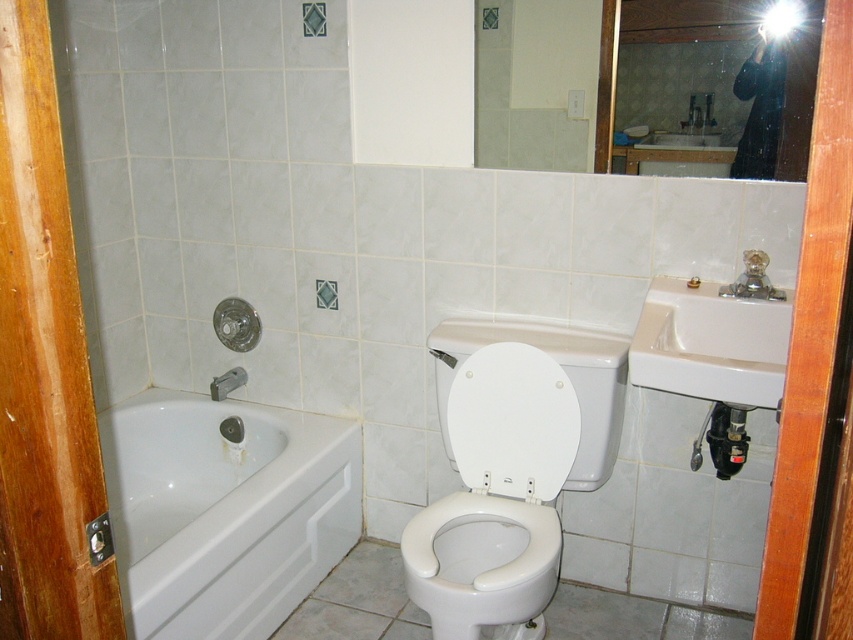
Question: Which point appears closest to the camera in this image?

Choices:
 (A) (216, 396)
 (B) (160, 522)
 (C) (674, 362)

Answer: (C)

Question: Is white glossy bathtub at lower left positioned in front of white ceramic sink at right?

Choices:
 (A) yes
 (B) no

Answer: (B)

Question: From the image, what is the correct spatial relationship of white glossy toilet at center in relation to white glossy toilet bowl at center?

Choices:
 (A) left
 (B) right

Answer: (B)

Question: Which point is farther to the camera?

Choices:
 (A) (762, 154)
 (B) (451, 611)

Answer: (A)

Question: In this image, where is white ceramic sink at right located relative to matte silver showerhead at lower left?

Choices:
 (A) left
 (B) right

Answer: (B)

Question: Among these points, which one is nearest to the camera?

Choices:
 (A) (740, 93)
 (B) (680, 321)

Answer: (A)